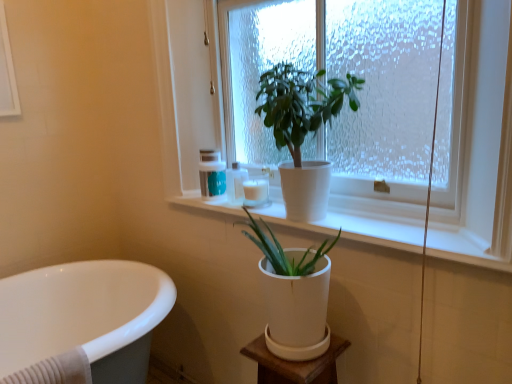
Describe the element at coordinates (294, 295) in the screenshot. This screenshot has width=512, height=384. I see `white matte pot at center, the first houseplant when ordered from bottom to top` at that location.

What do you see at coordinates (257, 190) in the screenshot? I see `white matte candle at center, the third toiletry from the left` at bounding box center [257, 190].

You are a GUI agent. You are given a task and a screenshot of the screen. Output one action in this format:
    pyautogui.click(x=<x>, y=<y>)
    Task: Click on the white glossy bathtub at lower left
    The image size is (512, 384).
    Given the screenshot: What is the action you would take?
    pyautogui.click(x=81, y=322)

Image resolution: width=512 pixels, height=384 pixels. What do you see at coordinates (303, 131) in the screenshot? I see `green matte plant at upper center, the second houseplant positioned from the bottom` at bounding box center [303, 131].

The width and height of the screenshot is (512, 384). I want to click on white matte pot at center, the first houseplant when ordered from bottom to top, so click(x=294, y=295).

Considering the relative positions of matte white bottle at upper center, the 2th toiletry positioned from the right, and matte white container at upper center, which is counted as the third toiletry, starting from the right, in the image provided, is matte white bottle at upper center, the 2th toiletry positioned from the right, in front of matte white container at upper center, which is counted as the third toiletry, starting from the right,?

Yes, matte white bottle at upper center, the 2th toiletry positioned from the right, is closer to the viewer.

Is matte white bottle at upper center, placed as the 2th toiletry when sorted from left to right, next to matte white container at upper center, which is counted as the third toiletry, starting from the right?

Yes, matte white bottle at upper center, placed as the 2th toiletry when sorted from left to right, is in contact with matte white container at upper center, which is counted as the third toiletry, starting from the right.

Considering the sizes of objects matte white bottle at upper center, the 2th toiletry positioned from the right, and matte white container at upper center, which is the 1th toiletry in left-to-right order, in the image provided, who is wider, matte white bottle at upper center, the 2th toiletry positioned from the right, or matte white container at upper center, which is the 1th toiletry in left-to-right order,?

matte white bottle at upper center, the 2th toiletry positioned from the right, is wider.

Considering the positions of point (237, 168) and point (222, 180), is point (237, 168) closer or farther from the camera than point (222, 180)?

Clearly, point (237, 168) is more distant from the camera than point (222, 180).

Measure the distance between white matte plant pot at upper center and green matte plant at upper center, acting as the 1th houseplant starting from the top.

white matte plant pot at upper center is 9.12 inches away from green matte plant at upper center, acting as the 1th houseplant starting from the top.

Based on the photo, who is smaller, white matte plant pot at upper center or green matte plant at upper center, the second houseplant positioned from the bottom?

green matte plant at upper center, the second houseplant positioned from the bottom, is smaller.

Is white matte plant pot at upper center located outside green matte plant at upper center, the second houseplant positioned from the bottom?

Yes.

Can you confirm if white matte plant pot at upper center is shorter than green matte plant at upper center, the second houseplant positioned from the bottom?

In fact, white matte plant pot at upper center may be taller than green matte plant at upper center, the second houseplant positioned from the bottom.

Find the location of a particular element. Image resolution: width=512 pixels, height=384 pixels. window sill located on the right of matte white bottle at upper center, placed as the 2th toiletry when sorted from left to right is located at coordinates (354, 225).

Considering the relative sizes of white matte window sill at upper center and matte white bottle at upper center, placed as the 2th toiletry when sorted from left to right, in the image provided, is white matte window sill at upper center taller than matte white bottle at upper center, placed as the 2th toiletry when sorted from left to right,?

In fact, white matte window sill at upper center may be shorter than matte white bottle at upper center, placed as the 2th toiletry when sorted from left to right.

In terms of size, does white matte window sill at upper center appear bigger or smaller than matte white bottle at upper center, placed as the 2th toiletry when sorted from left to right?

Considering their sizes, white matte window sill at upper center takes up more space than matte white bottle at upper center, placed as the 2th toiletry when sorted from left to right.

Would you say white matte window sill at upper center is to the left or to the right of matte white bottle at upper center, the 2th toiletry positioned from the right, in the picture?

Based on their positions, white matte window sill at upper center is located to the right of matte white bottle at upper center, the 2th toiletry positioned from the right.

Is matte white bottle at upper center, the 2th toiletry positioned from the right, positioned before white matte window sill at upper center?

No, it is behind white matte window sill at upper center.

Is matte white bottle at upper center, placed as the 2th toiletry when sorted from left to right, surrounding white matte window sill at upper center?

No, white matte window sill at upper center is located outside of matte white bottle at upper center, placed as the 2th toiletry when sorted from left to right.

From a real-world perspective, is matte white bottle at upper center, the 2th toiletry positioned from the right, above or below white matte window sill at upper center?

From a real-world perspective, matte white bottle at upper center, the 2th toiletry positioned from the right, is physically above white matte window sill at upper center.

Consider the image. Is matte white bottle at upper center, the 2th toiletry positioned from the right, facing away from white matte window sill at upper center?

matte white bottle at upper center, the 2th toiletry positioned from the right, is not turned away from white matte window sill at upper center.

Considering the sizes of matte white container at upper center, which is counted as the third toiletry, starting from the right, and white glossy bathtub at lower left in the image, is matte white container at upper center, which is counted as the third toiletry, starting from the right, wider or thinner than white glossy bathtub at lower left?

Clearly, matte white container at upper center, which is counted as the third toiletry, starting from the right, has less width compared to white glossy bathtub at lower left.

From the image's perspective, between matte white container at upper center, which is the 1th toiletry in left-to-right order, and white glossy bathtub at lower left, who is located below?

white glossy bathtub at lower left is shown below in the image.

From their relative heights in the image, would you say matte white container at upper center, which is the 1th toiletry in left-to-right order, is taller or shorter than white glossy bathtub at lower left?

Clearly, matte white container at upper center, which is the 1th toiletry in left-to-right order, is shorter compared to white glossy bathtub at lower left.

Does matte white container at upper center, which is the 1th toiletry in left-to-right order, come in front of white glossy bathtub at lower left?

No, it is not.

Which point is more forward, [172,305] or [294,264]?

The point [294,264] is closer to the camera.

Which object is positioned more to the right, white glossy bathtub at lower left or white matte pot at center, the first houseplant when ordered from bottom to top?

From the viewer's perspective, white matte pot at center, the first houseplant when ordered from bottom to top, appears more on the right side.

Does white glossy bathtub at lower left turn towards white matte pot at center, the first houseplant when ordered from bottom to top?

Yes, white glossy bathtub at lower left is oriented towards white matte pot at center, the first houseplant when ordered from bottom to top.

Is white matte pot at center, the first houseplant when ordered from bottom to top, oriented away from matte white container at upper center, which is the 1th toiletry in left-to-right order?

No, white matte pot at center, the first houseplant when ordered from bottom to top, is not facing the opposite direction of matte white container at upper center, which is the 1th toiletry in left-to-right order.

Would you say white matte pot at center, the second houseplant from the top, is to the left or to the right of matte white container at upper center, which is the 1th toiletry in left-to-right order, in the picture?

white matte pot at center, the second houseplant from the top, is to the right of matte white container at upper center, which is the 1th toiletry in left-to-right order.

Between point (309, 272) and point (224, 172), which one is positioned in front?

The point (309, 272) is closer to the camera.

Based on the photo, can you confirm if white matte pot at center, the first houseplant when ordered from bottom to top, is thinner than matte white container at upper center, which is counted as the third toiletry, starting from the right?

No, white matte pot at center, the first houseplant when ordered from bottom to top, is not thinner than matte white container at upper center, which is counted as the third toiletry, starting from the right.

From a real-world perspective, count 1st toiletrys downward from the matte white container at upper center, which is the 1th toiletry in left-to-right order, and point to it. Please provide its 2D coordinates.

[(236, 183)]

The image size is (512, 384). I want to click on window in front of the green matte plant at upper center, the second houseplant positioned from the bottom, so click(476, 139).

Estimate the real-world distances between objects in this image. Which object is closer to white matte candle at center, the third toiletry from the left, matte white bottle at upper center, placed as the 2th toiletry when sorted from left to right, or white matte pot at lower center?

Among the two, matte white bottle at upper center, placed as the 2th toiletry when sorted from left to right, is located nearer to white matte candle at center, the third toiletry from the left.

Estimate the real-world distances between objects in this image. Which object is closer to matte white bottle at upper center, placed as the 2th toiletry when sorted from left to right, matte white container at upper center, which is the 1th toiletry in left-to-right order, or white matte plant pot at upper center?

Based on the image, matte white container at upper center, which is the 1th toiletry in left-to-right order, appears to be nearer to matte white bottle at upper center, placed as the 2th toiletry when sorted from left to right.

Estimate the real-world distances between objects in this image. Which object is closer to white matte plant pot at upper center, green matte plant at upper center, the second houseplant positioned from the bottom, or white glossy bathtub at lower left?

Among the two, green matte plant at upper center, the second houseplant positioned from the bottom, is located nearer to white matte plant pot at upper center.

Considering their positions, is white matte plant pot at upper center positioned further to matte white bottle at upper center, placed as the 2th toiletry when sorted from left to right, than green matte plant at upper center, acting as the 1th houseplant starting from the top?

Among the two, white matte plant pot at upper center is located further to matte white bottle at upper center, placed as the 2th toiletry when sorted from left to right.

Which object lies nearer to the anchor point matte white bottle at upper center, placed as the 2th toiletry when sorted from left to right, matte white container at upper center, which is the 1th toiletry in left-to-right order, or white matte pot at center, the second houseplant from the top?

matte white container at upper center, which is the 1th toiletry in left-to-right order.

From the picture: Which object lies nearer to the anchor point white matte pot at lower center, white matte candle at center, the 1th toiletry in the right-to-left sequence, or white matte plant pot at upper center?

white matte candle at center, the 1th toiletry in the right-to-left sequence.

In the scene shown: Which object lies nearer to the anchor point white matte pot at center, the first houseplant when ordered from bottom to top, matte white bottle at upper center, the 2th toiletry positioned from the right, or white matte window sill at upper center?

white matte window sill at upper center.

Which object lies further to the anchor point white glossy bathtub at lower left, white matte plant pot at upper center or matte white container at upper center, which is the 1th toiletry in left-to-right order?

Among the two, white matte plant pot at upper center is located further to white glossy bathtub at lower left.

Where is `vanity between green matte plant at upper center, acting as the 1th houseplant starting from the top, and white glossy bathtub at lower left in the up-down direction`? vanity between green matte plant at upper center, acting as the 1th houseplant starting from the top, and white glossy bathtub at lower left in the up-down direction is located at coordinates (295, 362).

The height and width of the screenshot is (384, 512). Identify the location of window sill between white matte plant pot at upper center and white glossy bathtub at lower left in the vertical direction. (354, 225).

Find the location of `vanity between white matte window sill at upper center and matte white container at upper center, which is counted as the third toiletry, starting from the right, along the z-axis`. vanity between white matte window sill at upper center and matte white container at upper center, which is counted as the third toiletry, starting from the right, along the z-axis is located at coordinates pos(295,362).

The image size is (512, 384). I want to click on window sill between green matte plant at upper center, the second houseplant positioned from the bottom, and white matte pot at center, the first houseplant when ordered from bottom to top, in the vertical direction, so click(354, 225).